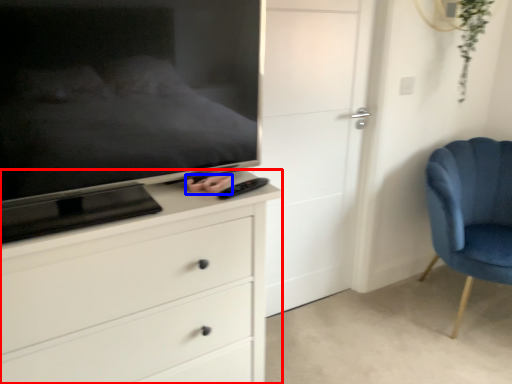
Question: Which object is further to the camera taking this photo, chest of drawers (highlighted by a red box) or hand (highlighted by a blue box)?

Choices:
 (A) chest of drawers
 (B) hand

Answer: (B)